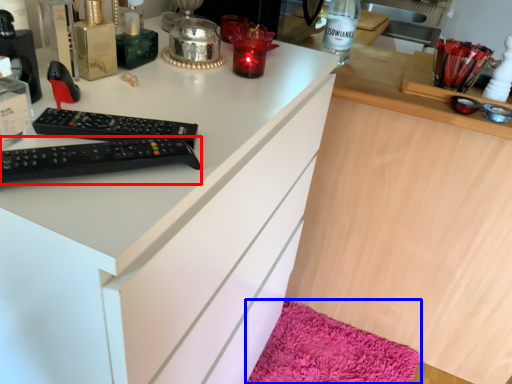
Question: Which object is closer to the camera taking this photo, remote control (highlighted by a red box) or bath mat (highlighted by a blue box)?

Choices:
 (A) remote control
 (B) bath mat

Answer: (A)